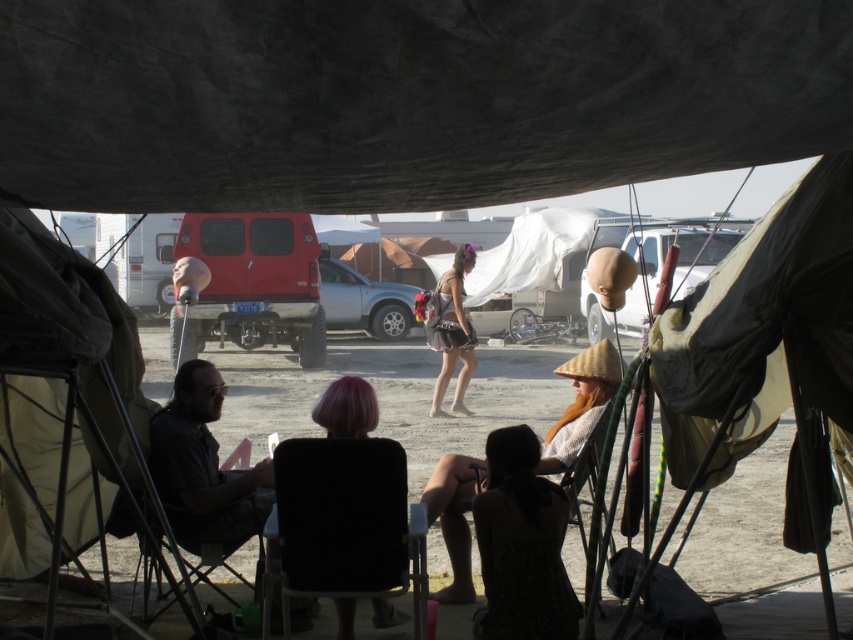
Question: In this image, where is dark brown fabric dress at lower center located relative to dark gray shirt at left?

Choices:
 (A) right
 (B) left

Answer: (A)

Question: Is dark gray shirt at left closer to the viewer compared to shiny metallic skirt at center?

Choices:
 (A) no
 (B) yes

Answer: (B)

Question: Does dark gray shirt at left have a smaller size compared to silky pink hair at center?

Choices:
 (A) no
 (B) yes

Answer: (A)

Question: Which point is farther from the camera taking this photo?

Choices:
 (A) (335, 403)
 (B) (480, 536)

Answer: (A)

Question: Estimate the real-world distances between objects in this image. Which object is farther from the beige straw hat at center?

Choices:
 (A) shiny metallic skirt at center
 (B) dark gray shirt at left
 (C) silky pink hair at center
 (D) dark brown fabric dress at lower center

Answer: (A)

Question: Which point is closer to the camera taking this photo?

Choices:
 (A) (355, 378)
 (B) (210, 397)
 (C) (561, 506)

Answer: (C)